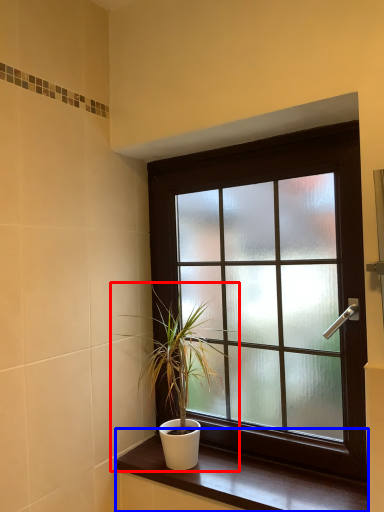
Question: Among these objects, which one is nearest to the camera, houseplant (highlighted by a red box) or window sill (highlighted by a blue box)?

Choices:
 (A) houseplant
 (B) window sill

Answer: (B)